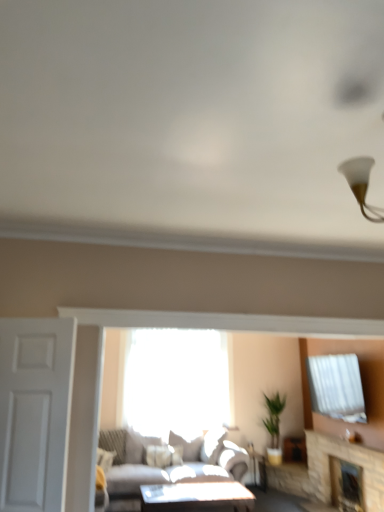
Locate an element on the screen. blank space above white matte door at left (from a real-world perspective) is located at coordinates (33, 317).